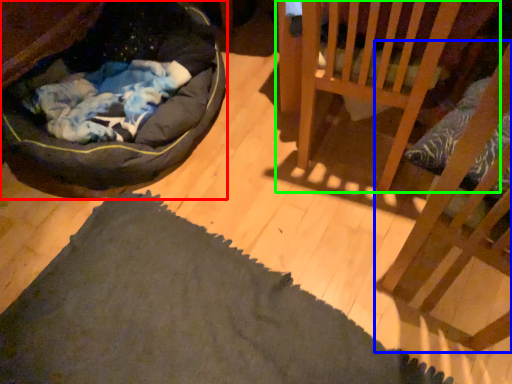
Question: Considering the real-world distances, which object is closest to dog bed (highlighted by a red box)? furniture (highlighted by a blue box) or furniture (highlighted by a green box).

Choices:
 (A) furniture
 (B) furniture

Answer: (B)